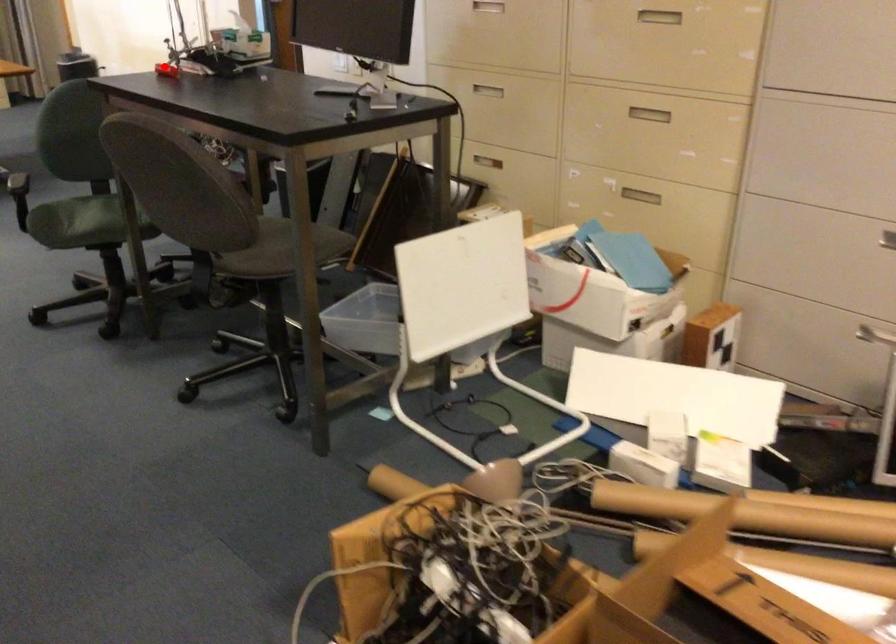
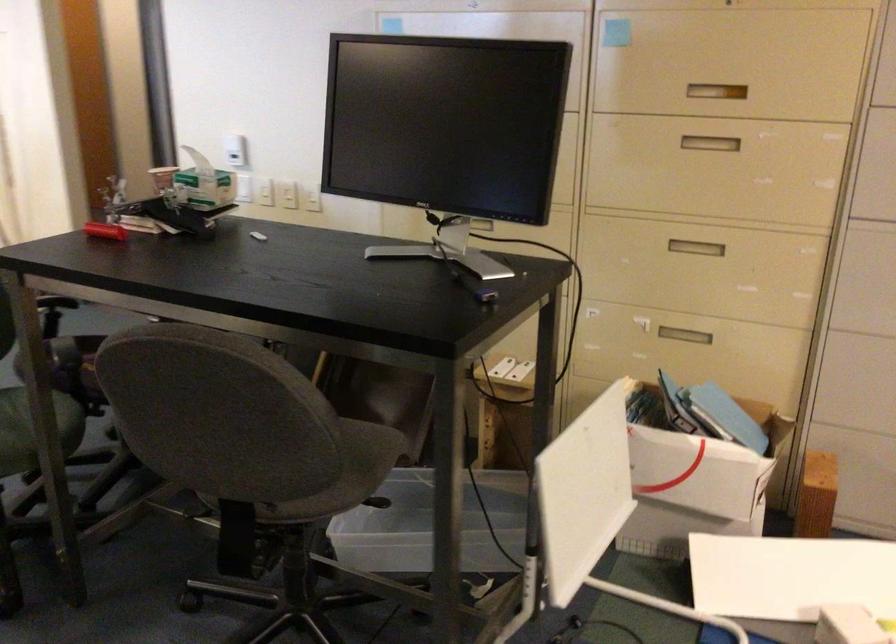
Question: I am providing you with two images of the same scene from different viewpoints. Image1 has a red point marked. In image2, the corresponding 3D location appears at what relative position? Reply with the corresponding letter.

Choices:
 (A) Closer
 (B) Farther

Answer: (A)